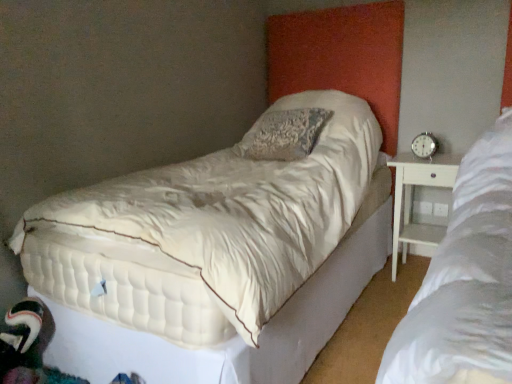
Where is `white wood nightstand at right`? The height and width of the screenshot is (384, 512). white wood nightstand at right is located at coordinates (412, 199).

How distant is white wood nightstand at right from white quilted mattress at center?

3.42 feet.

Is white quilted mattress at center located within white wood nightstand at right?

No, white quilted mattress at center is located outside of white wood nightstand at right.

Is point (408, 153) closer or farther from the camera than point (237, 326)?

Point (408, 153) appears to be farther away from the viewer than point (237, 326).

Is white wood nightstand at right facing towards white quilted mattress at center?

No, white wood nightstand at right is not turned towards white quilted mattress at center.

What's the angular difference between white quilted mattress at center and silver metallic alarm clock at right's facing directions?

12 degrees.

Considering the sizes of objects white quilted mattress at center and silver metallic alarm clock at right in the image provided, who is thinner, white quilted mattress at center or silver metallic alarm clock at right?

silver metallic alarm clock at right is thinner.

Which is correct: white quilted mattress at center is inside silver metallic alarm clock at right, or outside of it?

white quilted mattress at center is located beyond the bounds of silver metallic alarm clock at right.

Considering the sizes of objects silver metallic alarm clock at right and white quilted mattress at center in the image provided, who is taller, silver metallic alarm clock at right or white quilted mattress at center?

With more height is white quilted mattress at center.

Looking at this image, considering the sizes of objects silver metallic alarm clock at right and white quilted mattress at center in the image provided, who is smaller, silver metallic alarm clock at right or white quilted mattress at center?

silver metallic alarm clock at right is smaller.

From the image's perspective, who appears lower, silver metallic alarm clock at right or white quilted mattress at center?

white quilted mattress at center appears lower in the image.

Is silver metallic alarm clock at right beside white quilted mattress at center?

silver metallic alarm clock at right and white quilted mattress at center are clearly separated.

From the image's perspective, is white quilted mattress at center below white wood nightstand at right?

No, from the image's perspective, white quilted mattress at center is not beneath white wood nightstand at right.

Based on the photo, does white quilted mattress at center contain white wood nightstand at right?

Actually, white wood nightstand at right is outside white quilted mattress at center.

In the scene shown: Which of these two, white quilted mattress at center or white wood nightstand at right, stands shorter?

white wood nightstand at right.

Is white quilted mattress at center to the left of white wood nightstand at right from the viewer's perspective?

Indeed, white quilted mattress at center is positioned on the left side of white wood nightstand at right.

Which of these two, white wood nightstand at right or silver metallic alarm clock at right, stands taller?

white wood nightstand at right is taller.

Is white wood nightstand at right oriented away from silver metallic alarm clock at right?

That's not correct — white wood nightstand at right is not looking away from silver metallic alarm clock at right.

From the image's perspective, relative to silver metallic alarm clock at right, is white wood nightstand at right above or below?

Clearly, from the image's perspective, white wood nightstand at right is below silver metallic alarm clock at right.

Does point (405, 254) appear closer or farther from the camera than point (428, 137)?

Point (405, 254) is farther from the camera than point (428, 137).

Consider the image. From the image's perspective, is silver metallic alarm clock at right located beneath white wood nightstand at right?

No.

Can you tell me how much silver metallic alarm clock at right and white wood nightstand at right differ in facing direction?

The facing directions of silver metallic alarm clock at right and white wood nightstand at right are 12 degrees apart.

From a real-world perspective, is silver metallic alarm clock at right physically below white wood nightstand at right?

Actually, silver metallic alarm clock at right is physically above white wood nightstand at right in the real world.

From the picture: Considering the relative sizes of silver metallic alarm clock at right and white wood nightstand at right in the image provided, is silver metallic alarm clock at right bigger than white wood nightstand at right?

Actually, silver metallic alarm clock at right might be smaller than white wood nightstand at right.

This screenshot has height=384, width=512. Find the location of `nightstand behind the white quilted mattress at center`. nightstand behind the white quilted mattress at center is located at coordinates (412, 199).

The height and width of the screenshot is (384, 512). I want to click on alarm clock below the white quilted mattress at center (from a real-world perspective), so click(424, 145).

Based on their spatial positions, is silver metallic alarm clock at right or white quilted mattress at center closer to white wood nightstand at right?

silver metallic alarm clock at right is closer to white wood nightstand at right.

Looking at the image, which one is located further to silver metallic alarm clock at right, white quilted mattress at center or white wood nightstand at right?

white quilted mattress at center is positioned further to the anchor silver metallic alarm clock at right.

When comparing their distances from silver metallic alarm clock at right, does white wood nightstand at right or white quilted mattress at center seem further?

Among the two, white quilted mattress at center is located further to silver metallic alarm clock at right.

Which object lies further to the anchor point white quilted mattress at center, silver metallic alarm clock at right or white wood nightstand at right?

The object further to white quilted mattress at center is silver metallic alarm clock at right.

From the image, which object appears to be nearer to white wood nightstand at right, white quilted mattress at center or silver metallic alarm clock at right?

silver metallic alarm clock at right lies closer to white wood nightstand at right than the other object.

When comparing their distances from white quilted mattress at center, does white wood nightstand at right or silver metallic alarm clock at right seem closer?

white wood nightstand at right is positioned closer to the anchor white quilted mattress at center.

What are the coordinates of `nightstand between white quilted mattress at center and silver metallic alarm clock at right in the front-back direction` in the screenshot? It's located at (412, 199).